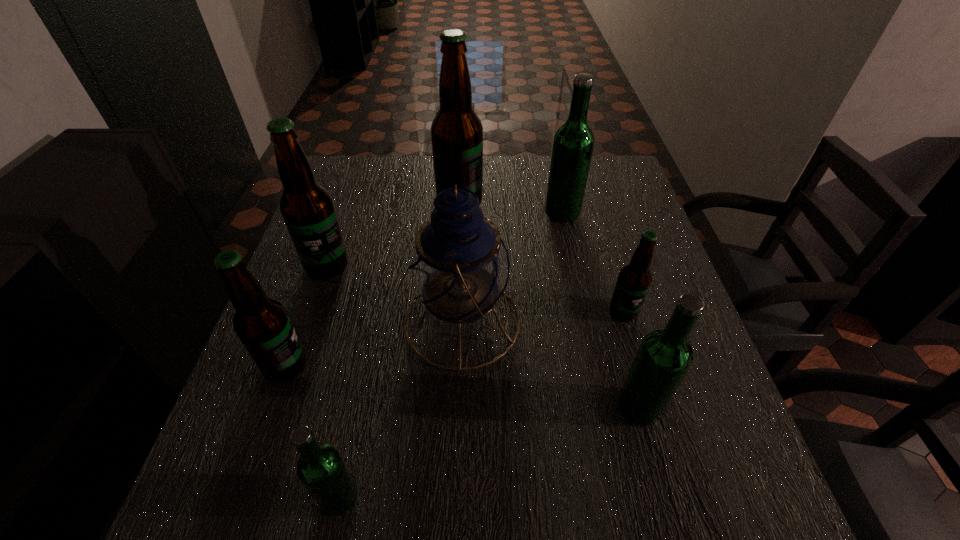
Identify the location of free spot between the third farthest beer bottle and the sixth farthest beer bottle. (483, 336).

Find the location of `vacant point located between the lantern and the second farthest green beer bottle`. vacant point located between the lantern and the second farthest green beer bottle is located at coordinates (550, 364).

I want to click on free space that is in between the farthest green beer bottle and the blue lantern, so click(x=512, y=267).

This screenshot has width=960, height=540. Identify the location of free space between the fifth beer bottle from right to left and the biggest green beer bottle. (451, 354).

This screenshot has width=960, height=540. What are the coordinates of `free space between the third beer bottle from left to right and the biggest brown beer bottle` in the screenshot? It's located at (399, 349).

This screenshot has width=960, height=540. Find the location of `free space that is in between the nearest brown beer bottle and the third farthest beer bottle`. free space that is in between the nearest brown beer bottle and the third farthest beer bottle is located at coordinates (306, 316).

This screenshot has width=960, height=540. What are the coordinates of `vacant region between the second nearest brown beer bottle and the nearest beer bottle` in the screenshot? It's located at (481, 404).

Locate an element on the screen. The height and width of the screenshot is (540, 960). free area in between the nearest object and the sixth farthest beer bottle is located at coordinates (490, 452).

Where is `object that is the closest to the seventh farthest object`? object that is the closest to the seventh farthest object is located at coordinates (634, 279).

I want to click on the seventh closest object to the farthest brown beer bottle, so click(321, 469).